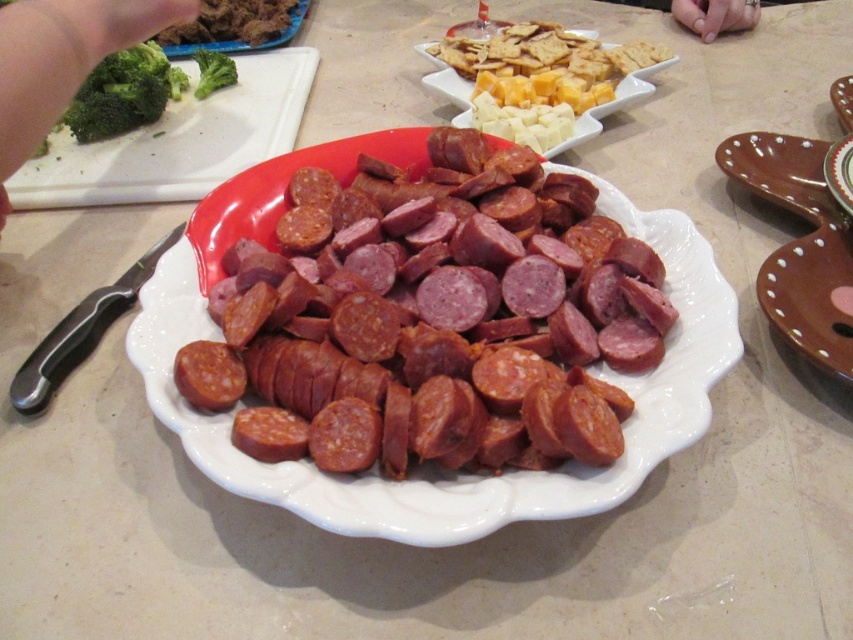
Question: Which object is positioned farthest from the red glossy salami at center?

Choices:
 (A) green broccoli at upper left
 (B) brown ceramic plate at upper right
 (C) matte brown plate at upper left

Answer: (C)

Question: Which object is positioned closest to the brown ceramic plate at lower right?

Choices:
 (A) green broccoli at upper left
 (B) green leafy broccoli at upper left

Answer: (A)

Question: Is brown ceramic plate at lower right to the right of green leafy broccoli at upper left from the viewer's perspective?

Choices:
 (A) no
 (B) yes

Answer: (B)

Question: Which point is closer to the camera?

Choices:
 (A) (219, 358)
 (B) (93, 166)
 (C) (393, 138)

Answer: (A)

Question: Is matte brown plate at upper left wider than red glossy salami at center?

Choices:
 (A) no
 (B) yes

Answer: (B)

Question: Can you confirm if white glossy plate at center is positioned to the right of matte brown plate at upper left?

Choices:
 (A) yes
 (B) no

Answer: (A)